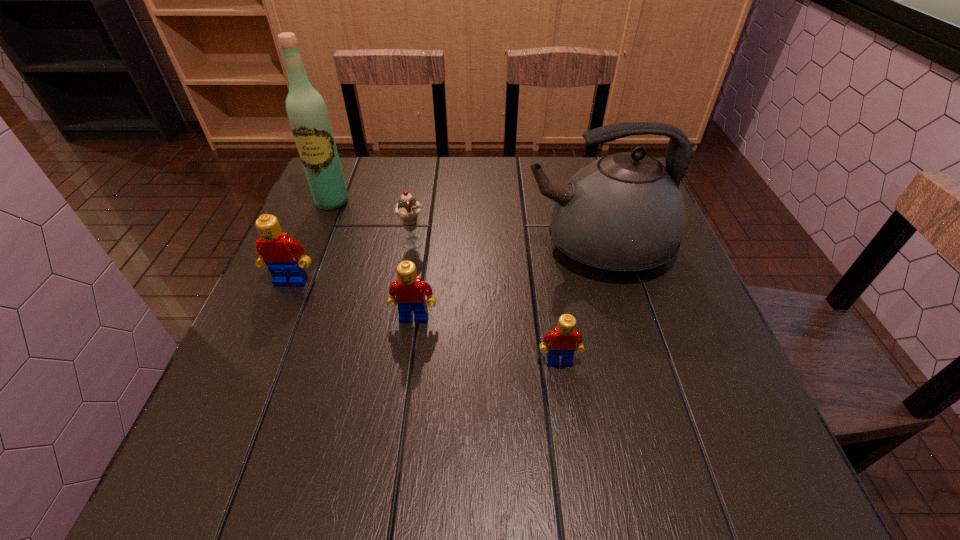
Image resolution: width=960 pixels, height=540 pixels. Identify the location of object positioned at the right edge. (624, 213).

Locate an element on the screen. The image size is (960, 540). object that is at the far left corner is located at coordinates (308, 116).

You are a GUI agent. You are given a task and a screenshot of the screen. Output one action in this format:
    pyautogui.click(x=<x>, y=<y>)
    Task: Click on the blank space at the far edge of the desktop
    Image resolution: width=960 pixels, height=540 pixels.
    Given the screenshot: What is the action you would take?
    pyautogui.click(x=456, y=180)

I want to click on free spot at the left edge of the desktop, so click(254, 314).

At what (x,y) coordinates should I click in order to perform the action: click on vacant space at the right edge. Please return your answer as a coordinate pair (x, y). The height and width of the screenshot is (540, 960). Looking at the image, I should click on (697, 318).

Where is `blank area at the far left corner`? Image resolution: width=960 pixels, height=540 pixels. blank area at the far left corner is located at coordinates [362, 173].

Image resolution: width=960 pixels, height=540 pixels. Identify the location of vacant area between the icecream and the tallest object. (372, 223).

Locate an element on the screen. free space between the rightmost Lego and the second Lego from left to right is located at coordinates (487, 340).

Locate an element on the screen. The image size is (960, 540). free area in between the icecream and the fifth shortest object is located at coordinates (505, 245).

Image resolution: width=960 pixels, height=540 pixels. In order to click on vacant space that's between the farthest object and the icecream in this screenshot , I will do `click(372, 223)`.